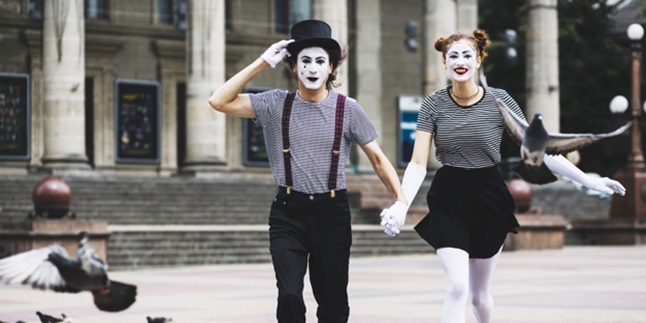
Where is `pillar`? The height and width of the screenshot is (323, 646). pillar is located at coordinates (x=81, y=111).